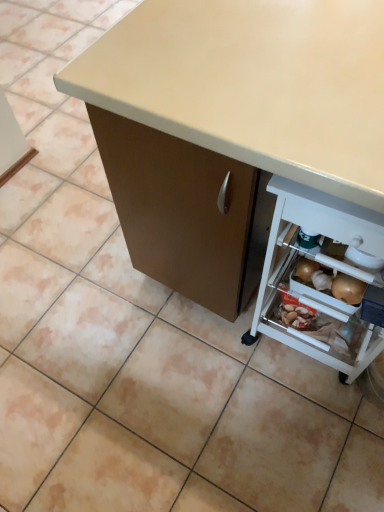
Question: Does matte beige desk at center have a smaller size compared to white plastic shelf at lower right?

Choices:
 (A) no
 (B) yes

Answer: (A)

Question: Is matte beige desk at center taller than white plastic shelf at lower right?

Choices:
 (A) yes
 (B) no

Answer: (A)

Question: Would you consider matte beige desk at center to be distant from white plastic shelf at lower right?

Choices:
 (A) yes
 (B) no

Answer: (B)

Question: From the image's perspective, is matte beige desk at center over white plastic shelf at lower right?

Choices:
 (A) yes
 (B) no

Answer: (A)

Question: From a real-world perspective, is matte beige desk at center on top of white plastic shelf at lower right?

Choices:
 (A) no
 (B) yes

Answer: (B)

Question: Does matte beige desk at center have a larger size compared to white plastic shelf at lower right?

Choices:
 (A) yes
 (B) no

Answer: (A)

Question: Is white plastic shelf at lower right at the right side of matte beige desk at center?

Choices:
 (A) no
 (B) yes

Answer: (B)

Question: Can you confirm if white plastic shelf at lower right is thinner than matte beige desk at center?

Choices:
 (A) yes
 (B) no

Answer: (A)

Question: Does white plastic shelf at lower right have a greater width compared to matte beige desk at center?

Choices:
 (A) no
 (B) yes

Answer: (A)

Question: Does white plastic shelf at lower right have a greater height compared to matte beige desk at center?

Choices:
 (A) yes
 (B) no

Answer: (B)

Question: Is white plastic shelf at lower right surrounding matte beige desk at center?

Choices:
 (A) no
 (B) yes

Answer: (A)

Question: Is white plastic shelf at lower right in contact with matte beige desk at center?

Choices:
 (A) yes
 (B) no

Answer: (B)

Question: Considering the positions of matte beige desk at center and white plastic shelf at lower right in the image, is matte beige desk at center bigger or smaller than white plastic shelf at lower right?

Choices:
 (A) small
 (B) big

Answer: (B)